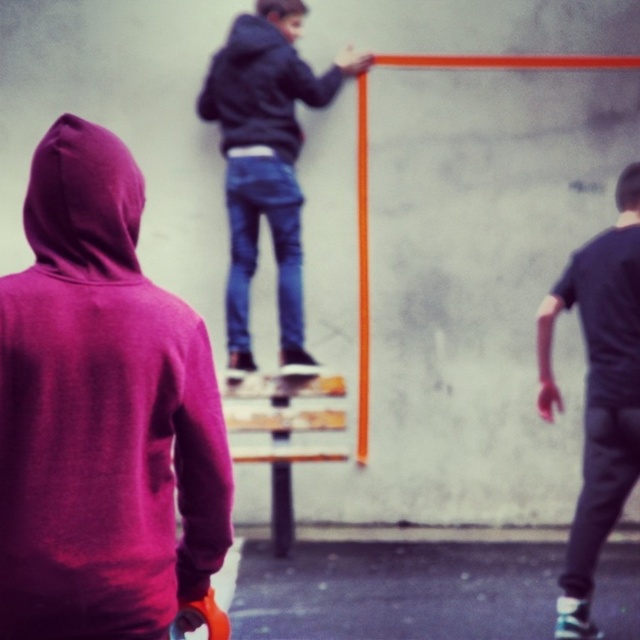
Question: Can you confirm if purple fleece hoodie at left is positioned to the left of matte black hoodie at upper center?

Choices:
 (A) yes
 (B) no

Answer: (A)

Question: Which point appears closest to the camera in this image?

Choices:
 (A) (612, 454)
 (B) (308, 100)
 (C) (128, 248)

Answer: (C)

Question: Is purple fleece hoodie at left closer to the viewer compared to matte black hoodie at upper center?

Choices:
 (A) no
 (B) yes

Answer: (B)

Question: From the image, what is the correct spatial relationship of purple fleece hoodie at left in relation to dark gray t-shirt at right?

Choices:
 (A) below
 (B) above

Answer: (B)

Question: Based on their relative distances, which object is farther from the purple fleece hoodie at left?

Choices:
 (A) dark gray t-shirt at right
 (B) matte black hoodie at upper center

Answer: (B)

Question: Which point is closer to the camera?

Choices:
 (A) purple fleece hoodie at left
 (B) dark gray t-shirt at right

Answer: (A)